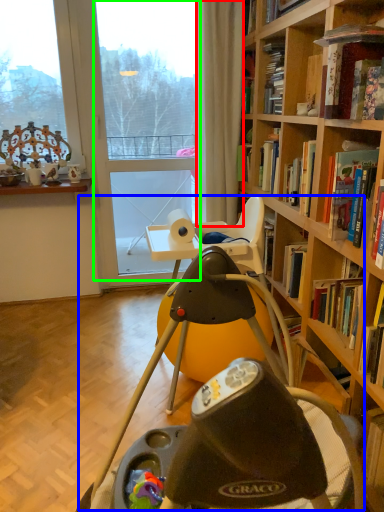
Question: Estimate the real-world distances between objects in this image. Which object is farther from curtain (highlighted by a red box), swivel chair (highlighted by a blue box) or glass door (highlighted by a green box)?

Choices:
 (A) swivel chair
 (B) glass door

Answer: (A)